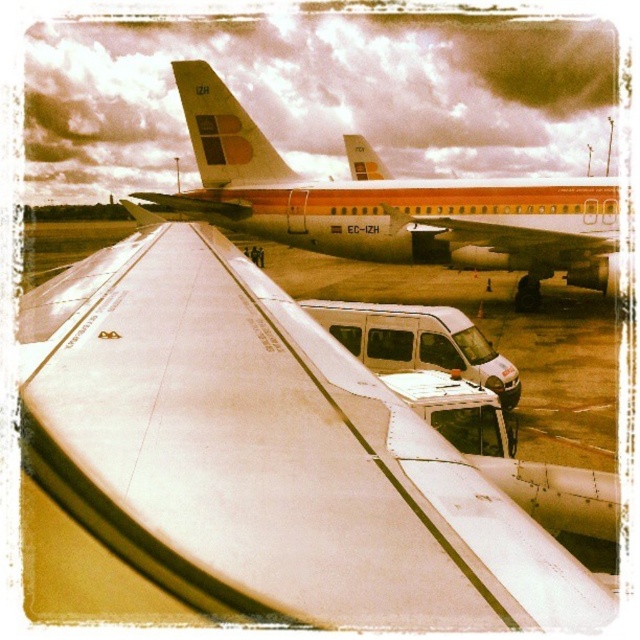
Based on the airport tarmac scene, if you are standing at the white matte van at center, which direction should you face to have the matte orange airplane wing at center directly to your right?

Since the white matte van at center is to the left of the matte orange airplane wing at center, you should face towards the right side to have the matte orange airplane wing at center directly to your right.